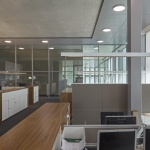
Find the location of `white lights`. white lights is located at coordinates (119, 8).